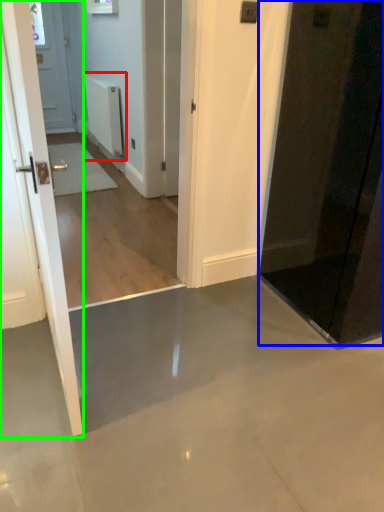
Question: Estimate the real-world distances between objects in this image. Which object is farther from radiator (highlighted by a red box), door (highlighted by a blue box) or door (highlighted by a green box)?

Choices:
 (A) door
 (B) door

Answer: (B)